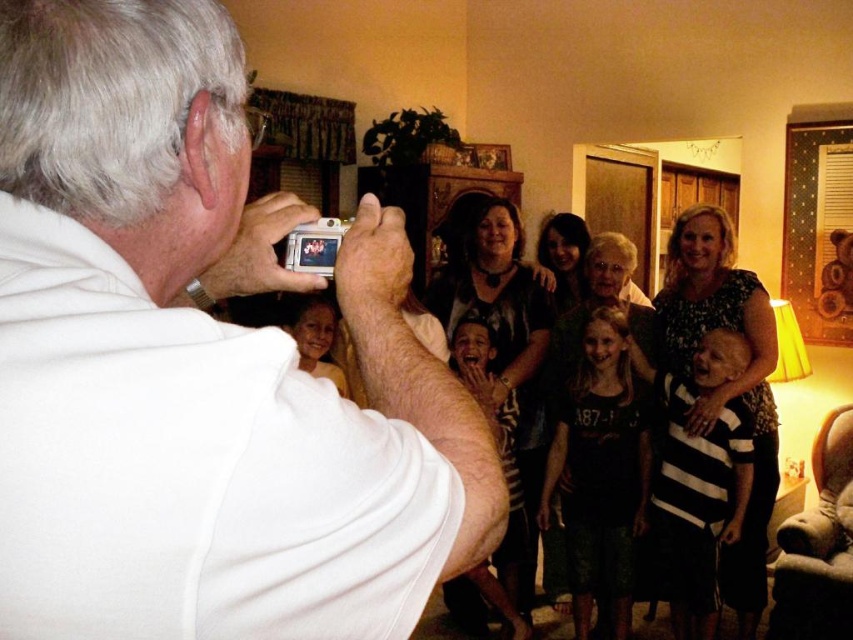
Does white matte camera at upper center have a greater height compared to dark gray shirt at center?

In fact, white matte camera at upper center may be shorter than dark gray shirt at center.

This screenshot has height=640, width=853. Identify the location of white matte camera at upper center. (199, 364).

Does dark gray striped dress at center have a greater height compared to striped fabric baby at center?

Incorrect, dark gray striped dress at center's height is not larger of striped fabric baby at center's.

Does point (711, 298) come in front of point (701, 273)?

Yes, point (711, 298) is closer to viewer.

You are a GUI agent. You are given a task and a screenshot of the screen. Output one action in this format:
    pyautogui.click(x=<x>, y=<y>)
    Task: Click on the dark gray striped dress at center
    The width and height of the screenshot is (853, 640).
    Given the screenshot: What is the action you would take?
    pyautogui.click(x=726, y=381)

How much distance is there between matte black dress at center and dark gray shirt at center?

matte black dress at center is 16.10 inches from dark gray shirt at center.

Does matte black dress at center have a smaller size compared to dark gray shirt at center?

No.

Between point (520, 289) and point (563, 250), which one is positioned behind?

The point (563, 250) is behind.

Locate an element on the screen. The height and width of the screenshot is (640, 853). matte black dress at center is located at coordinates (503, 352).